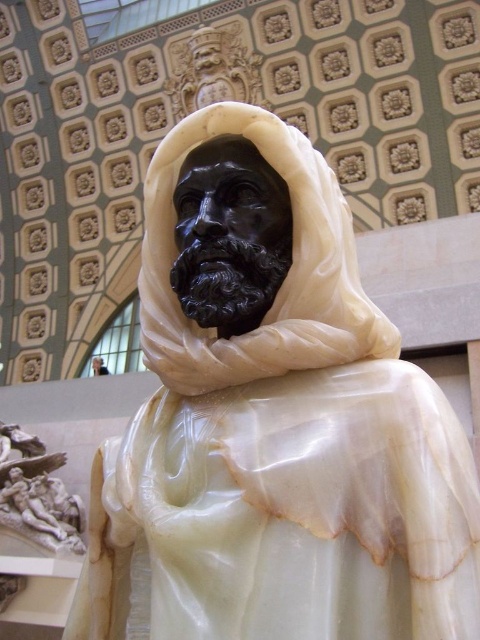
You are an art student standing in the room where the black marble statue at center and the white marble relief at lower left are displayed. You want to take a photo of both objects in the same frame. Which object should you position closer to the camera to ensure both are visible without moving the camera?

The black marble statue at center is to the right of the white marble relief at lower left, so you should position the camera closer to the white marble relief at lower left to include both in the frame since it is closer to the viewer.

You are an art conservator examining the image. You notice the black marble statue at center and the white marble relief at lower left. Which object is closer to you in the scene?

The black marble statue at center is closer to you because it is positioned in front of the white marble relief at lower left.

You are an interior designer assessing the space for a new art installation. The black marble statue at center and the white marble relief at lower left are currently placed in the room. If you want to replace the smaller artwork with a new sculpture, which one should you choose to replace?

The white marble relief at lower left should be replaced because it is smaller in size than the black marble statue at center, making it the better candidate for replacement.